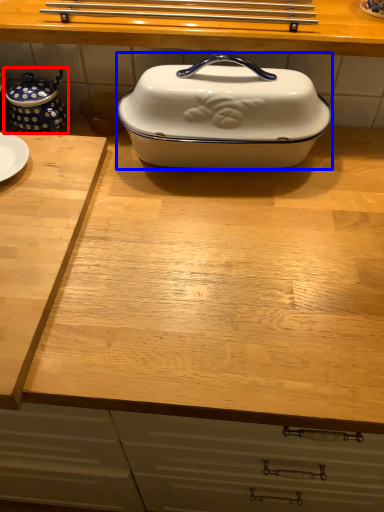
Question: Which of the following is the farthest to the observer, tea pot (highlighted by a red box) or kitchen appliance (highlighted by a blue box)?

Choices:
 (A) tea pot
 (B) kitchen appliance

Answer: (A)